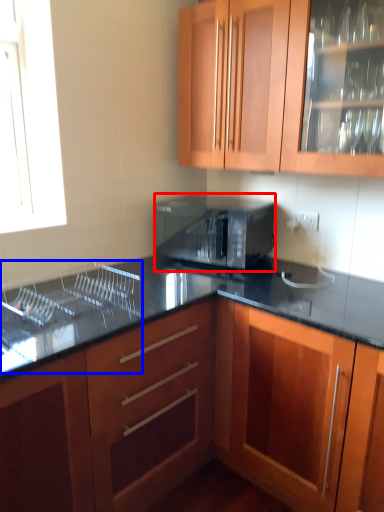
Question: Which point is further to the camera, microwave oven (highlighted by a red box) or sink (highlighted by a blue box)?

Choices:
 (A) microwave oven
 (B) sink

Answer: (A)